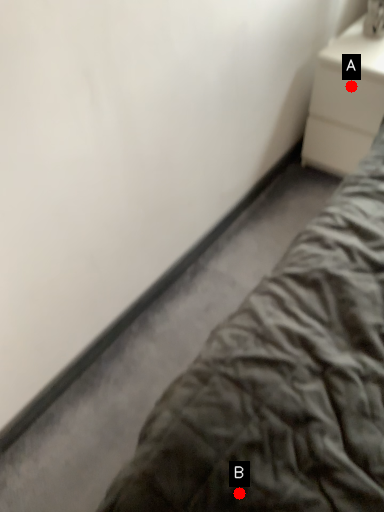
Question: Two points are circled on the image, labeled by A and B beside each circle. Which point is closer to the camera?

Choices:
 (A) A is closer
 (B) B is closer

Answer: (B)